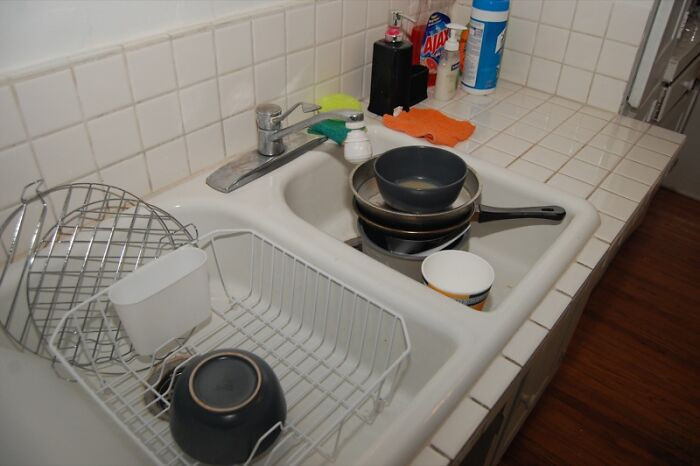
Locate an element on the screen. The width and height of the screenshot is (700, 466). dirty dishes is located at coordinates (411, 211), (239, 379).